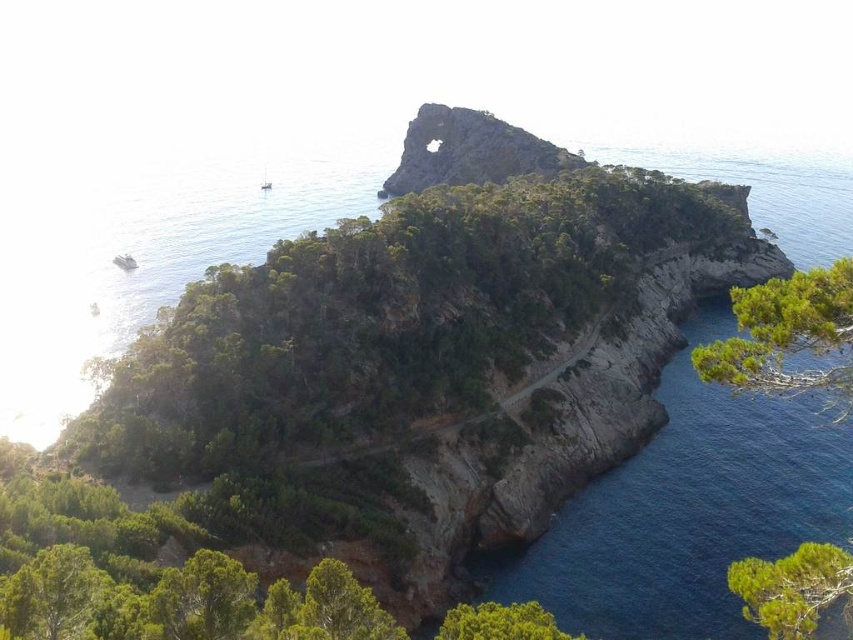
Question: Does green leafy tree at lower right appear on the left side of blue smooth water at lower right?

Choices:
 (A) yes
 (B) no

Answer: (B)

Question: Which point is farther to the camera?

Choices:
 (A) green textured tree at lower right
 (B) green leafy tree at lower right
 (C) blue smooth water at lower right
 (D) green leafy tree at lower center

Answer: (D)

Question: Which object appears closest to the camera in this image?

Choices:
 (A) green leafy tree at lower left
 (B) green leafy tree at lower right

Answer: (B)

Question: Is green leafy tree at lower right thinner than blue smooth water at lower right?

Choices:
 (A) no
 (B) yes

Answer: (A)

Question: Which object is farther from the camera taking this photo?

Choices:
 (A) blue smooth water at lower right
 (B) green leafy tree at lower right
 (C) rusty stone arch at upper center
 (D) green leafy tree at lower left

Answer: (C)

Question: Can you confirm if green leafy tree at lower right is wider than green leafy tree at lower center?

Choices:
 (A) yes
 (B) no

Answer: (A)